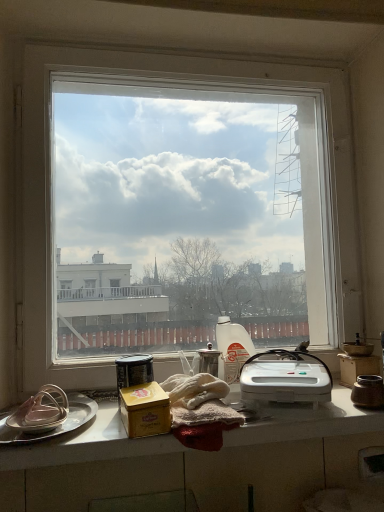
The width and height of the screenshot is (384, 512). Find the location of `spots to the right of matte silver lid at left, marked as the first appliance in a left-to-right arrangement`. spots to the right of matte silver lid at left, marked as the first appliance in a left-to-right arrangement is located at coordinates pyautogui.click(x=103, y=426).